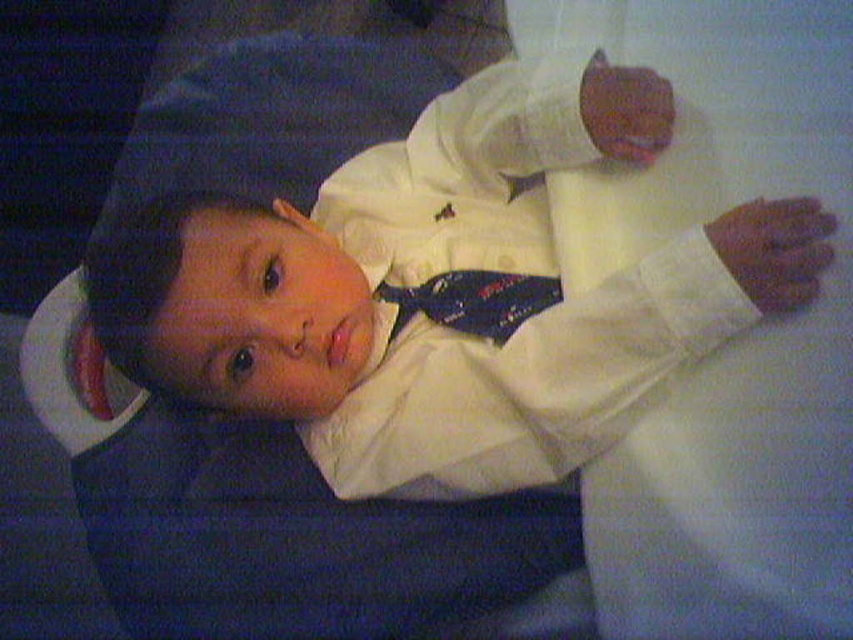
Question: Is white satin suit at center further to camera compared to blue satin tie at center?

Choices:
 (A) yes
 (B) no

Answer: (B)

Question: Does white satin suit at center appear over blue satin tie at center?

Choices:
 (A) yes
 (B) no

Answer: (A)

Question: Can you confirm if white satin suit at center is bigger than blue satin tie at center?

Choices:
 (A) yes
 (B) no

Answer: (A)

Question: Among these points, which one is nearest to the camera?

Choices:
 (A) (395, 317)
 (B) (323, 180)

Answer: (A)